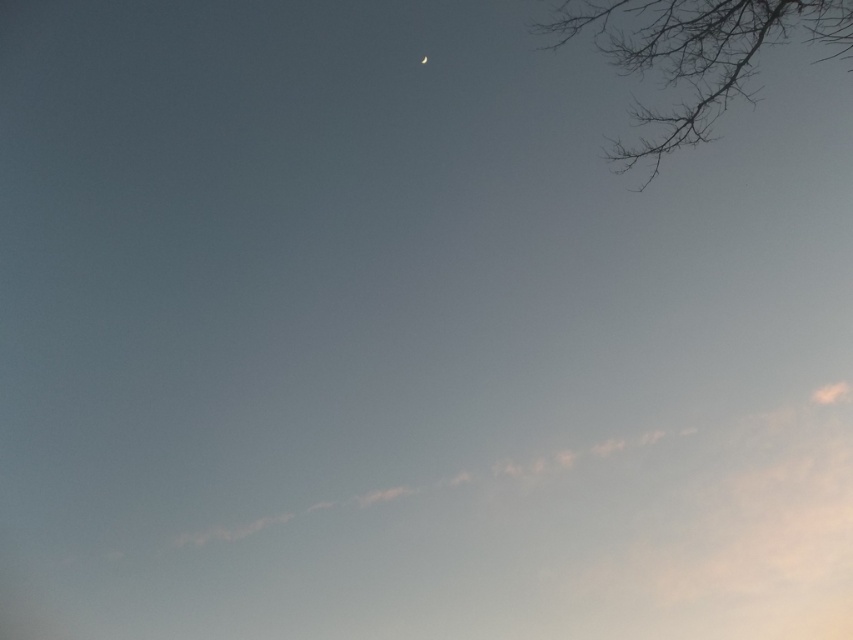
Question: Can you confirm if dark gray branches at upper right is wider than silver metallic crescent moon at upper center?

Choices:
 (A) no
 (B) yes

Answer: (B)

Question: Among these points, which one is nearest to the camera?

Choices:
 (A) (743, 22)
 (B) (422, 61)

Answer: (A)

Question: Which object is farther from the camera taking this photo?

Choices:
 (A) dark gray branches at upper right
 (B) silver metallic crescent moon at upper center

Answer: (B)

Question: Is dark gray branches at upper right bigger than silver metallic crescent moon at upper center?

Choices:
 (A) no
 (B) yes

Answer: (B)

Question: Is dark gray branches at upper right wider than silver metallic crescent moon at upper center?

Choices:
 (A) yes
 (B) no

Answer: (A)

Question: Which point is farther to the camera?

Choices:
 (A) dark gray branches at upper right
 (B) silver metallic crescent moon at upper center

Answer: (B)